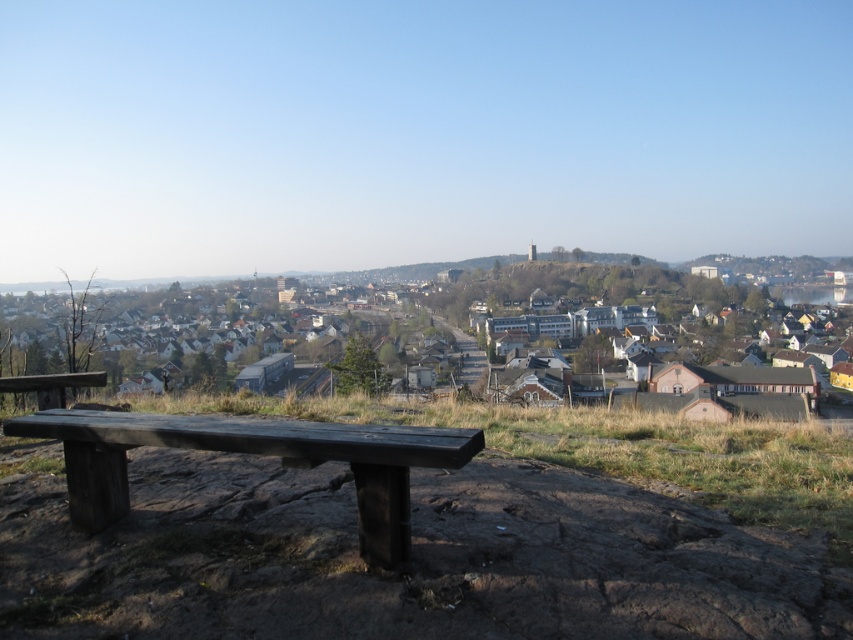
Who is more forward, (776, 502) or (26, 419)?

Point (26, 419) is in front.

Is point (403, 406) positioned in front of point (370, 465)?

That is False.

Between point (332, 410) and point (167, 433), which one is positioned in front?

Point (167, 433) is in front.

Image resolution: width=853 pixels, height=640 pixels. What are the coordinates of `brown grassy at lower center` in the screenshot? It's located at (621, 449).

Who is more forward, (404, 442) or (759, 380)?

Positioned in front is point (404, 442).

Between dark brown wood bench at lower left and matte brown houses at center, which one has more height?

matte brown houses at center

Does point (386, 524) come in front of point (672, 385)?

Yes, it is.

The height and width of the screenshot is (640, 853). Identify the location of dark brown wood bench at lower left. (253, 452).

Is dark brown wood bench at lower left in front of wooden bench at lower left?

Yes, it is in front of wooden bench at lower left.

You are a GUI agent. You are given a task and a screenshot of the screen. Output one action in this format:
    pyautogui.click(x=<x>, y=<y>)
    Task: Click on the dark brown wood bench at lower left
    
    Given the screenshot: What is the action you would take?
    pyautogui.click(x=253, y=452)